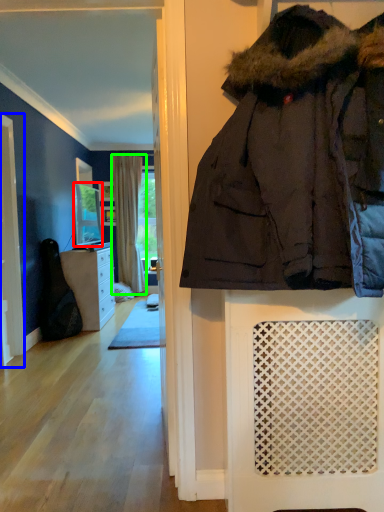
Question: Which object is positioned closest to mirror (highlighted by a red box)? Select from screen door (highlighted by a blue box) and curtain (highlighted by a green box).

Choices:
 (A) screen door
 (B) curtain

Answer: (B)